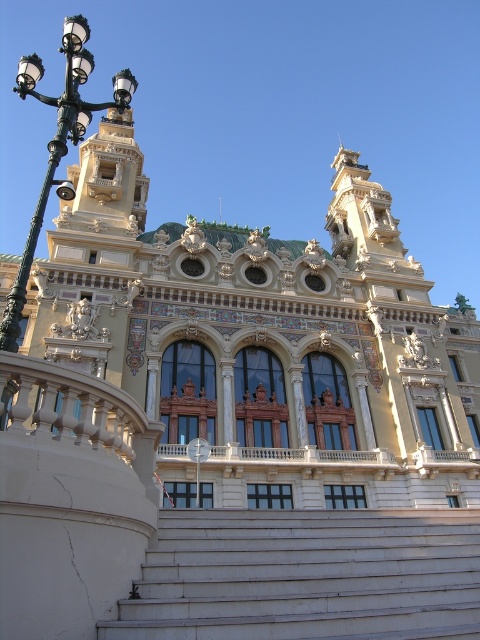
Question: Does white marble stairs at center lie in front of black metal streetlight at left?

Choices:
 (A) yes
 (B) no

Answer: (A)

Question: Which point appears closest to the camera in this image?

Choices:
 (A) (69, 67)
 (B) (468, 602)

Answer: (B)

Question: Where is white marble stairs at center located in relation to black metal streetlight at left in the image?

Choices:
 (A) right
 (B) left

Answer: (A)

Question: Does white marble stairs at center have a smaller size compared to black metal streetlight at left?

Choices:
 (A) no
 (B) yes

Answer: (B)